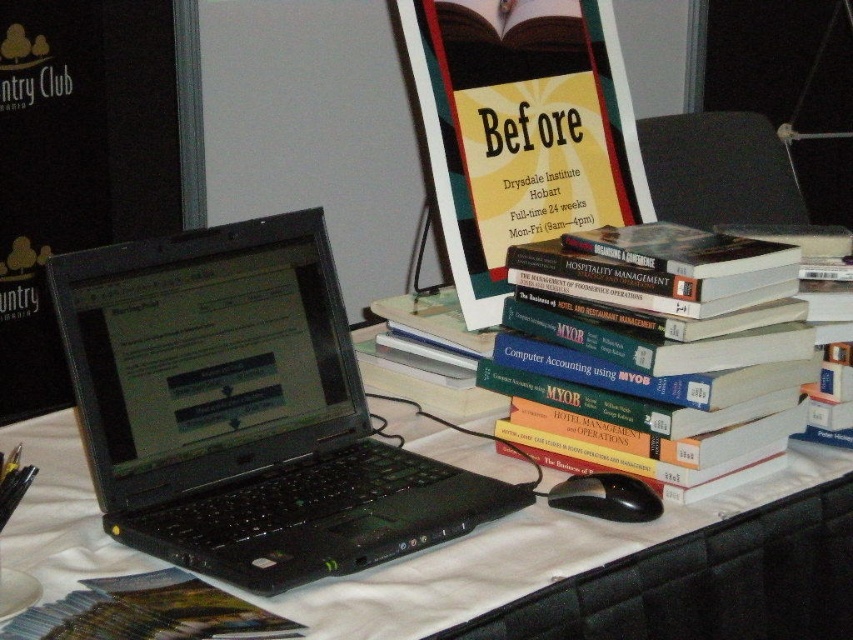
Which is behind, point (326, 522) or point (224, 612)?

Point (326, 522)

Is black plastic laptop at center to the left of green matte book at lower left from the viewer's perspective?

In fact, black plastic laptop at center is to the right of green matte book at lower left.

Who is more distant from viewer, (86, 420) or (102, 636)?

The point (86, 420) is behind.

Where is `black plastic laptop at center`? black plastic laptop at center is located at coordinates (244, 410).

Is hardcover books at center taller than green matte book at lower left?

Yes.

Is hardcover books at center to the right of green matte book at lower left from the viewer's perspective?

Indeed, hardcover books at center is positioned on the right side of green matte book at lower left.

Find the location of a particular element. The height and width of the screenshot is (640, 853). hardcover books at center is located at coordinates (654, 355).

This screenshot has height=640, width=853. I want to click on hardcover books at center, so click(x=654, y=355).

Does hardcover books at center have a lesser height compared to black plastic table at center?

Yes, hardcover books at center is shorter than black plastic table at center.

Is hardcover books at center bigger than black plastic table at center?

No, hardcover books at center is not bigger than black plastic table at center.

Does point (746, 241) lie behind point (340, 627)?

Yes, it is behind point (340, 627).

The width and height of the screenshot is (853, 640). I want to click on hardcover books at center, so click(x=654, y=355).